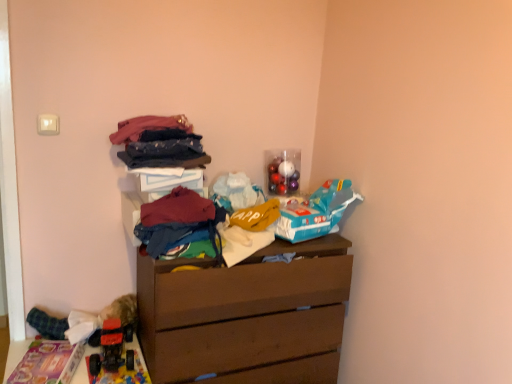
Find the location of a particular element. This screenshot has height=384, width=512. free space above multicolored fabric pile at center, the first clothing in the bottom-to-top sequence (from a real-world perspective) is located at coordinates (183, 213).